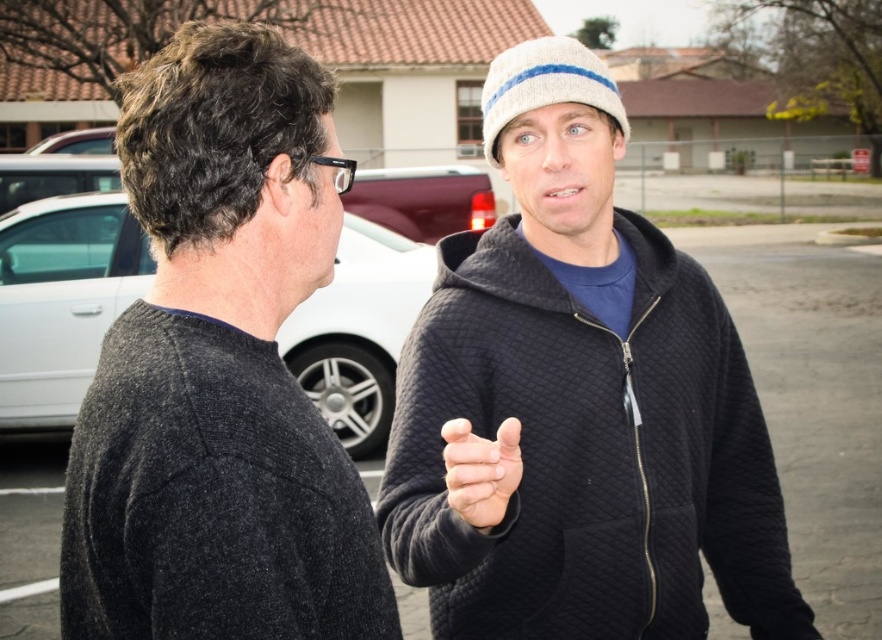
Question: Which point is closer to the camera taking this photo?

Choices:
 (A) (69, 545)
 (B) (402, 168)
 (C) (340, 323)
 (D) (578, 477)

Answer: (A)

Question: Does black quilted sweatshirt at center have a greater width compared to matte gray sedan at left?

Choices:
 (A) no
 (B) yes

Answer: (A)

Question: Estimate the real-world distances between objects in this image. Which object is farther from the matte red truck at center?

Choices:
 (A) dark gray sweater at left
 (B) white matte hand at center
 (C) black quilted sweatshirt at center

Answer: (B)

Question: Does dark gray sweater at left have a greater width compared to matte gray sedan at left?

Choices:
 (A) no
 (B) yes

Answer: (A)

Question: Is matte gray sedan at left closer to the viewer compared to white matte hand at center?

Choices:
 (A) yes
 (B) no

Answer: (B)

Question: Which point is farther from the camera taking this photo?

Choices:
 (A) (465, 310)
 (B) (365, 211)
 (C) (391, 316)
 (D) (295, 99)

Answer: (B)